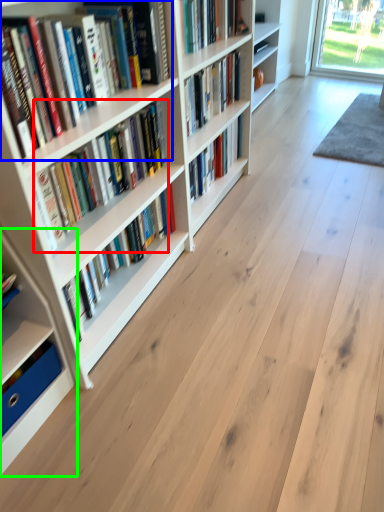
Question: Which object is the closest to the book (highlighted by a red box)? Choose among these: book (highlighted by a blue box) or shelf (highlighted by a green box).

Choices:
 (A) book
 (B) shelf

Answer: (A)